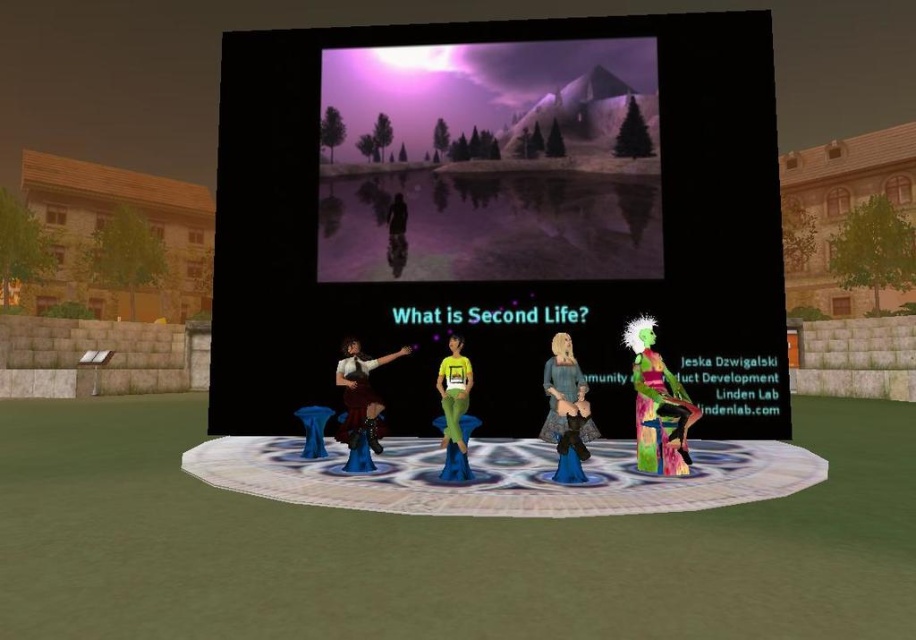
Question: Which of these objects is positioned farthest from the multicolored fabric figure at center?

Choices:
 (A) shiny silver dress at center
 (B) smooth black figure at center
 (C) matte yellow shirt at center

Answer: (B)

Question: From the image, what is the correct spatial relationship of matte black screen at center in relation to matte yellow shirt at center?

Choices:
 (A) below
 (B) above

Answer: (B)

Question: Does smooth purple sky at upper center appear under matte brown dress at center?

Choices:
 (A) yes
 (B) no

Answer: (B)

Question: Does multicolored fabric figure at center have a lesser width compared to matte blue dress at center?

Choices:
 (A) yes
 (B) no

Answer: (B)

Question: Which point is closer to the camera?

Choices:
 (A) (664, 84)
 (B) (664, 454)
 (C) (579, 376)
 (D) (511, 177)

Answer: (C)

Question: Which point is closer to the camera?

Choices:
 (A) matte yellow shirt at center
 (B) multicolored fabric figure at center
 (C) shiny silver dress at center
 (D) matte black screen at center

Answer: (C)